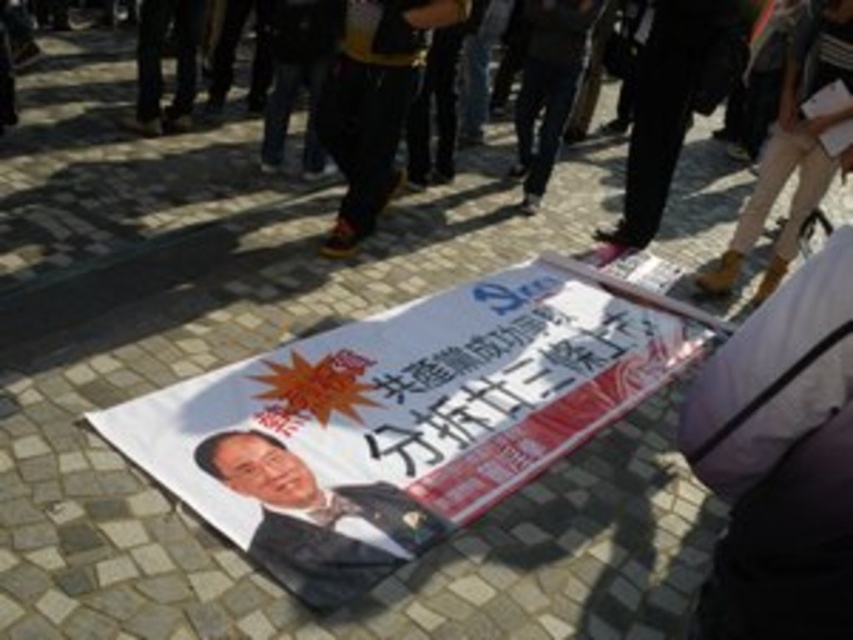
Question: Which of the following is the closest to the observer?

Choices:
 (A) (355, 545)
 (B) (0, 198)
 (C) (270, 472)

Answer: (A)

Question: Which of the following is the farthest from the observer?

Choices:
 (A) white paper poster at center
 (B) dark clothing at center

Answer: (B)

Question: Can you confirm if white paper poster at center is wider than dark clothing at center?

Choices:
 (A) yes
 (B) no

Answer: (A)

Question: Is white paper poster at center positioned at the back of smooth black suit at center?

Choices:
 (A) yes
 (B) no

Answer: (A)

Question: Which point is farther from the camera taking this photo?

Choices:
 (A) (117, 88)
 (B) (340, 522)

Answer: (A)

Question: Can you confirm if dark clothing at center is positioned to the right of smooth black suit at center?

Choices:
 (A) no
 (B) yes

Answer: (A)